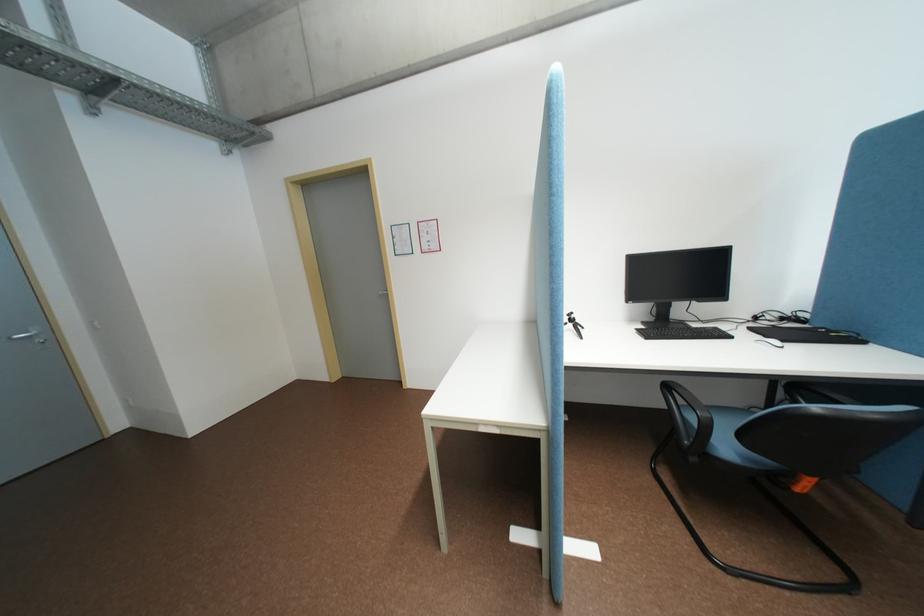
Where would you push the orange chair lever? Please return your answer as a coordinate pair (x, y).

(804, 485)